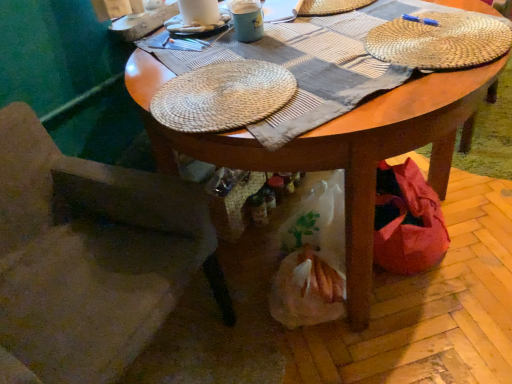
Find the location of a particular element. vacant space underneath woven straw placemat at upper right, which appears as the 2th hat when ordered from the bottom (from a real-world perspective) is located at coordinates (438, 37).